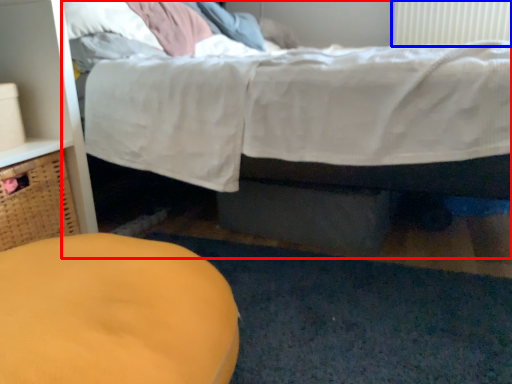
Question: Which object appears closest to the camera in this image, bed (highlighted by a red box) or radiator (highlighted by a blue box)?

Choices:
 (A) bed
 (B) radiator

Answer: (A)